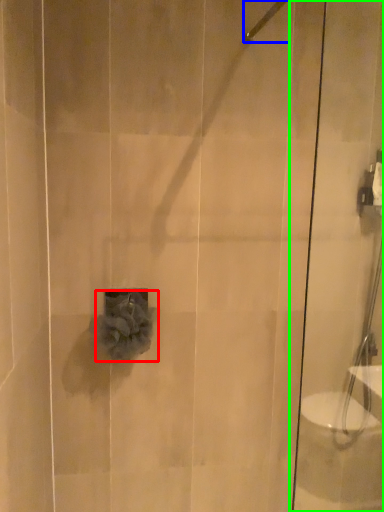
Question: Which object is the closest to the flower (highlighted by a red box)? Choose among these: shower (highlighted by a blue box) or shower door (highlighted by a green box).

Choices:
 (A) shower
 (B) shower door

Answer: (B)